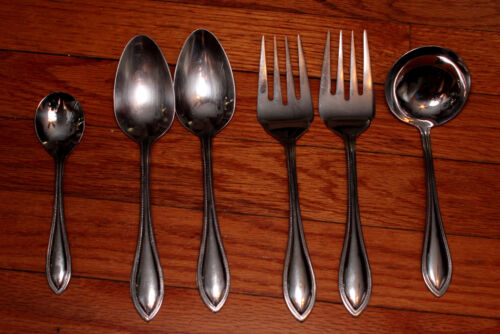
This screenshot has height=334, width=500. In order to click on forks in this screenshot , I will do `click(287, 120)`, `click(343, 120)`.